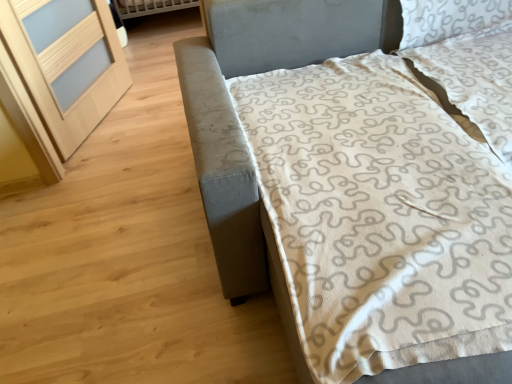
Where is `vacant area located to the right-hand side of light wood screen door at left`? vacant area located to the right-hand side of light wood screen door at left is located at coordinates (150, 105).